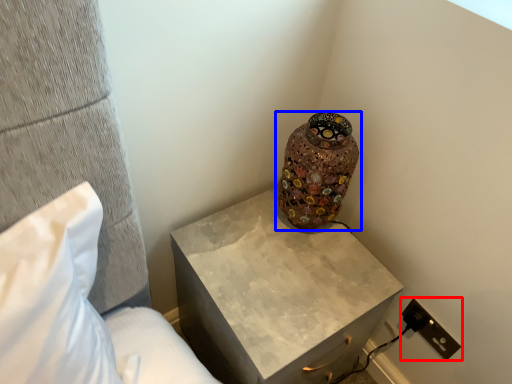
Question: Which object is further to the camera taking this photo, electric outlet (highlighted by a red box) or vase (highlighted by a blue box)?

Choices:
 (A) electric outlet
 (B) vase

Answer: (A)